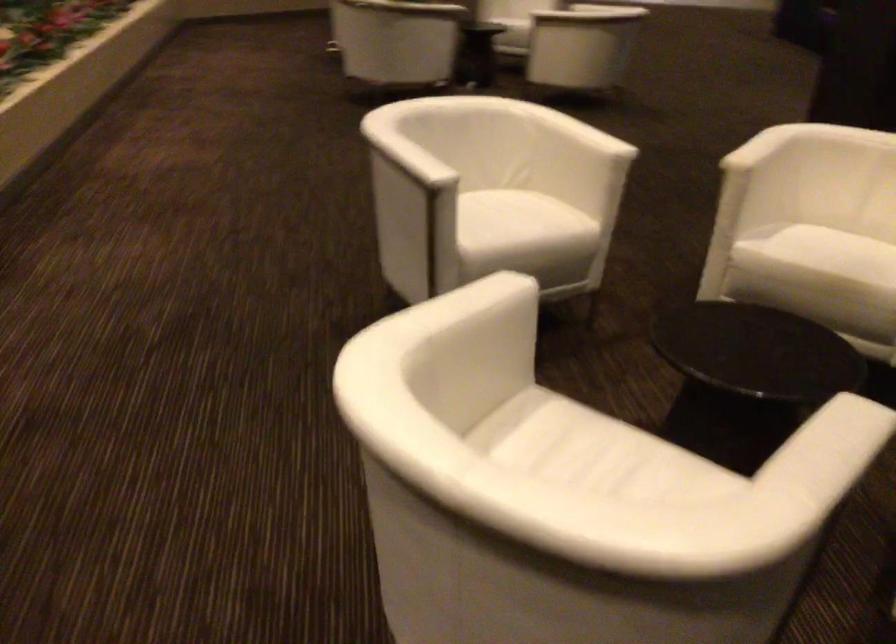
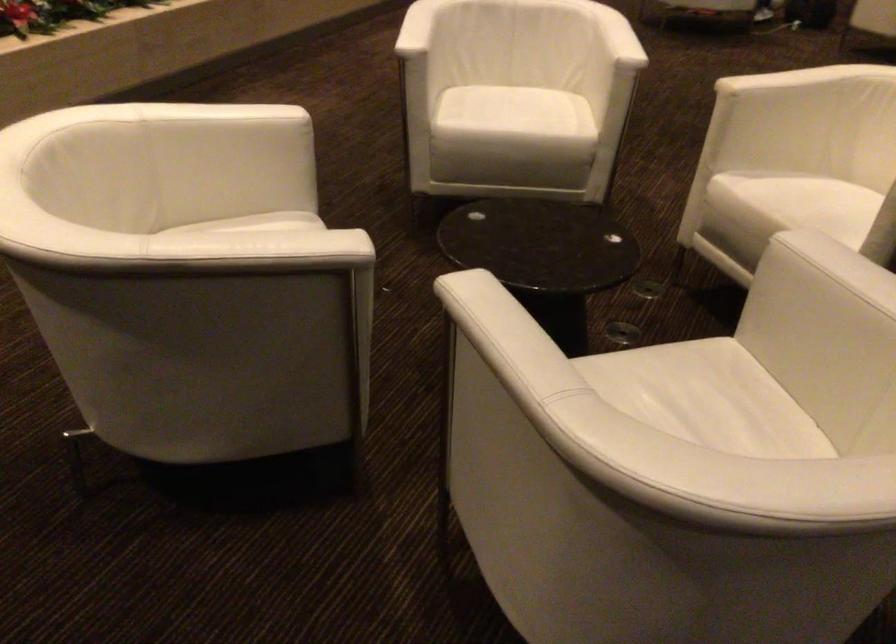
Find the pixel in the second image that matches pixel 599 131 in the first image.

(617, 37)